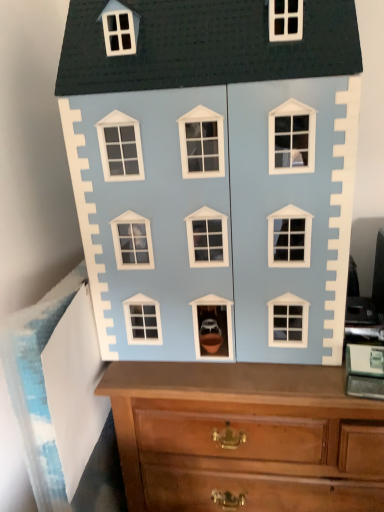
Question: Does wooden chest of drawers at center touch light blue matte house at center?

Choices:
 (A) no
 (B) yes

Answer: (A)

Question: Does wooden chest of drawers at center appear on the left side of light blue matte house at center?

Choices:
 (A) yes
 (B) no

Answer: (B)

Question: Is wooden chest of drawers at center taller than light blue matte house at center?

Choices:
 (A) no
 (B) yes

Answer: (B)

Question: Does wooden chest of drawers at center lie in front of light blue matte house at center?

Choices:
 (A) no
 (B) yes

Answer: (A)

Question: Is wooden chest of drawers at center smaller than light blue matte house at center?

Choices:
 (A) no
 (B) yes

Answer: (A)

Question: Does wooden chest of drawers at center have a lesser height compared to light blue matte house at center?

Choices:
 (A) no
 (B) yes

Answer: (A)

Question: Considering the relative positions of light blue matte house at center and wooden chest of drawers at center in the image provided, is light blue matte house at center behind wooden chest of drawers at center?

Choices:
 (A) yes
 (B) no

Answer: (B)

Question: From the image's perspective, would you say light blue matte house at center is positioned over wooden chest of drawers at center?

Choices:
 (A) no
 (B) yes

Answer: (B)

Question: Can you confirm if light blue matte house at center is bigger than wooden chest of drawers at center?

Choices:
 (A) no
 (B) yes

Answer: (A)

Question: Does light blue matte house at center have a greater width compared to wooden chest of drawers at center?

Choices:
 (A) no
 (B) yes

Answer: (A)

Question: From the image's perspective, is light blue matte house at center below wooden chest of drawers at center?

Choices:
 (A) no
 (B) yes

Answer: (A)

Question: Is light blue matte house at center smaller than wooden chest of drawers at center?

Choices:
 (A) no
 (B) yes

Answer: (B)

Question: Is point (168, 329) closer or farther from the camera than point (248, 408)?

Choices:
 (A) closer
 (B) farther

Answer: (B)